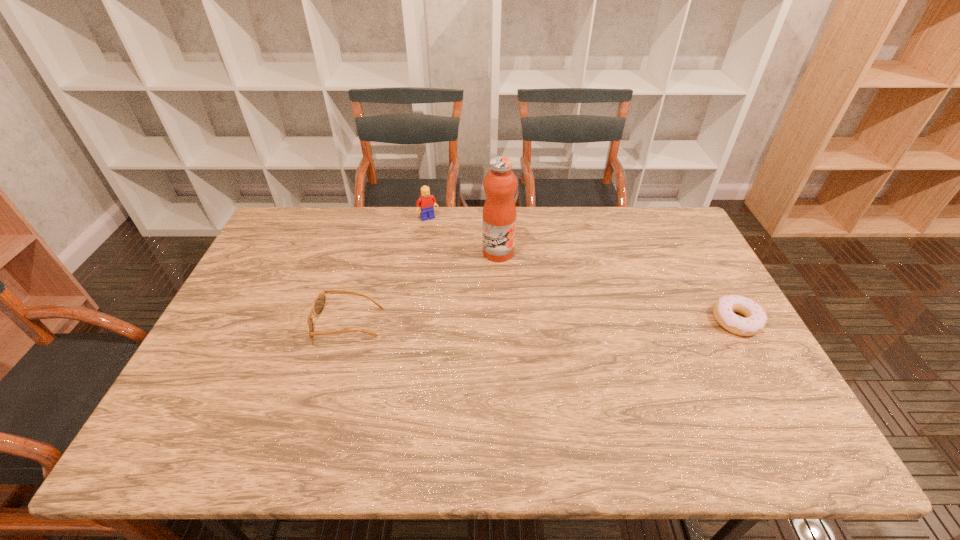
What are the coordinates of `free space located on the front-facing side of the leftmost object` in the screenshot? It's located at (232, 324).

Identify the location of vacant space positioned 0.160m on the front of the shortest object. (776, 391).

Find the location of `vacant space located on the front label of the fruit juice`. vacant space located on the front label of the fruit juice is located at coordinates (510, 272).

I want to click on vacant space located 0.310m on the front label of the fruit juice, so (x=546, y=333).

Where is `vacant area located on the front label of the fruit juice`? This screenshot has width=960, height=540. vacant area located on the front label of the fruit juice is located at coordinates (515, 280).

The image size is (960, 540). I want to click on vacant space situated 0.220m on the face of the Lego, so pos(456,258).

Image resolution: width=960 pixels, height=540 pixels. I want to click on vacant position located on the face of the Lego, so 444,239.

You are a GUI agent. You are given a task and a screenshot of the screen. Output one action in this format:
    pyautogui.click(x=<x>, y=<y>)
    Task: Click on the vacant position located 0.140m on the face of the Lego
    The height and width of the screenshot is (540, 960).
    Given the screenshot: What is the action you would take?
    pyautogui.click(x=446, y=244)

The width and height of the screenshot is (960, 540). Identify the location of fruit juice located in the far edge section of the desktop. (500, 183).

Where is `Lego located at the far edge`? Lego located at the far edge is located at coordinates (427, 202).